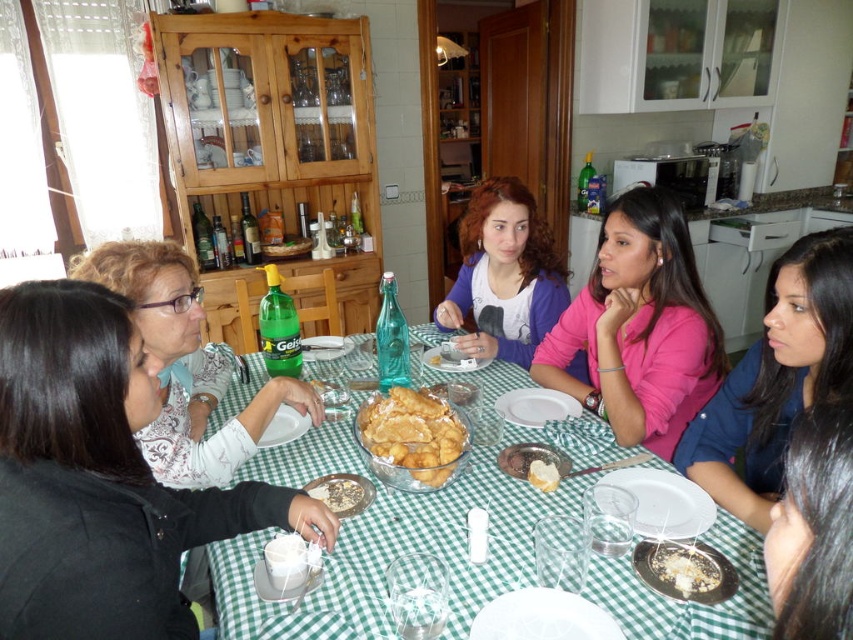
You are sitting at the dining table and want to reach for the green glass bowl at center. Which direction should you move your hand to grab it?

Since the green glass bowl at center is located at point 0.822 on the x and 0.491 on the y axis, you should move your hand towards the center of the table to grab it.